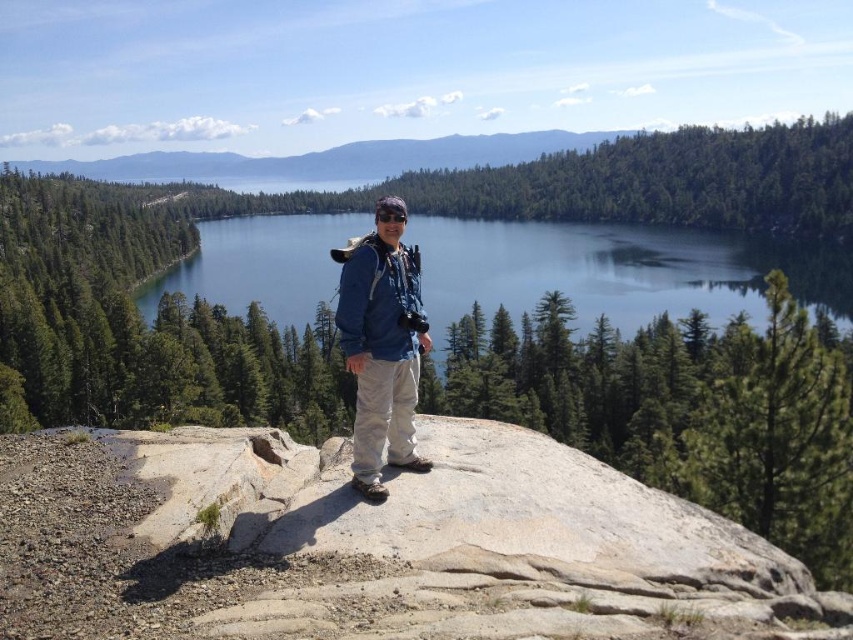
You are standing at the center of the rocky outcrop and want to take a photo of the blue glassy water at center. In which direction should you point your camera to capture it?

The blue glassy water at center is located at point coordinates, so you should point your camera towards the center of the scene to capture it.

You are a hiker standing on the gray granite rock at center and want to reach the blue glassy water at center. Which direction should you move to get there?

The gray granite rock at center is to the right of the blue glassy water at center, so you should move to the left to reach it.